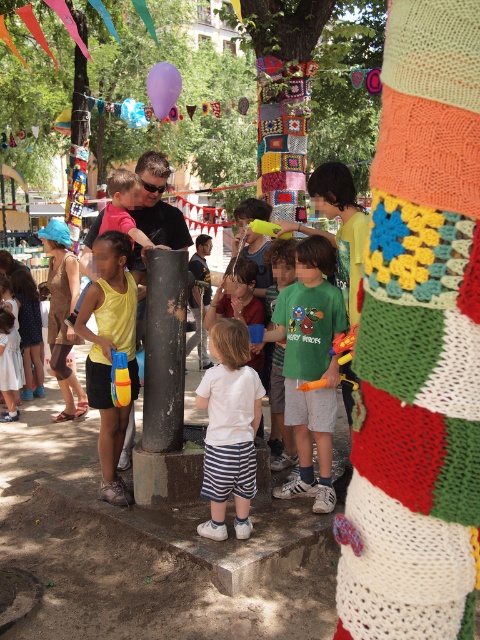
Question: Is white cotton shirt at center wider than purple fabric balloon at upper center?

Choices:
 (A) no
 (B) yes

Answer: (A)

Question: Is green matte shirt at center to the left of purple fabric balloon at upper center from the viewer's perspective?

Choices:
 (A) yes
 (B) no

Answer: (B)

Question: Is the position of green matte shirt at center less distant than that of purple fabric balloon at upper center?

Choices:
 (A) yes
 (B) no

Answer: (A)

Question: Which of the following is the closest to the observer?

Choices:
 (A) purple fabric balloon at upper center
 (B) green matte shirt at center
 (C) white cotton shirt at center
 (D) yellow matte tank top at left

Answer: (C)

Question: Which object is farther from the camera taking this photo?

Choices:
 (A) yellow matte tank top at left
 (B) green matte shirt at center
 (C) purple fabric balloon at upper center

Answer: (C)

Question: Which point is closer to the camera taking this photo?

Choices:
 (A) (323, 346)
 (B) (132, 385)
 (C) (158, 83)

Answer: (A)